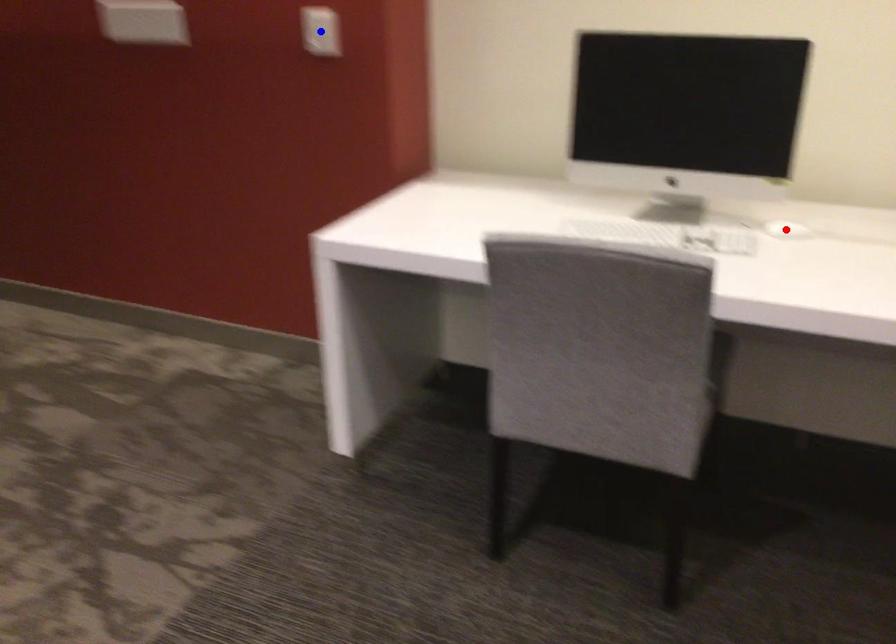
Question: Two points are marked on the image. Which point is closer to the camera?

Choices:
 (A) Blue point is closer.
 (B) Red point is closer.

Answer: (B)